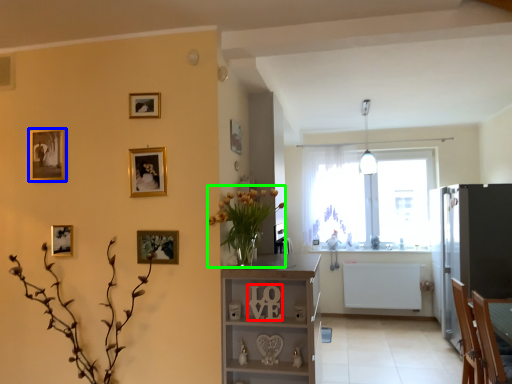
Question: Which object is positioned closest to number (highlighted by a red box)? Select from picture frame (highlighted by a blue box) and floral arrangement (highlighted by a green box).

Choices:
 (A) picture frame
 (B) floral arrangement

Answer: (B)